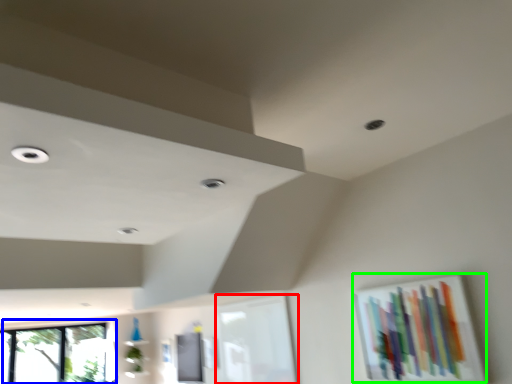
Question: Based on their relative distances, which object is farther from window frame (highlighted by a red box)? Choose from window (highlighted by a blue box) and picture frame (highlighted by a green box).

Choices:
 (A) window
 (B) picture frame

Answer: (A)